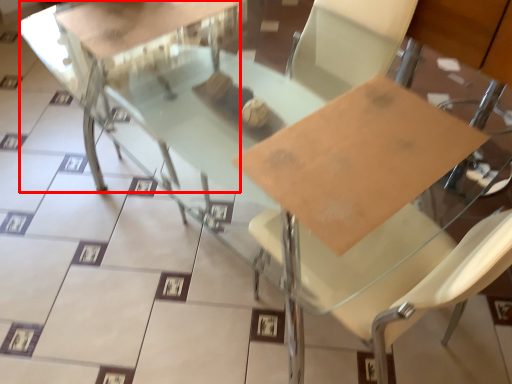
Question: From the image's perspective, where is round table (annotated by the red box) located relative to cardboard?

Choices:
 (A) above
 (B) below

Answer: (A)